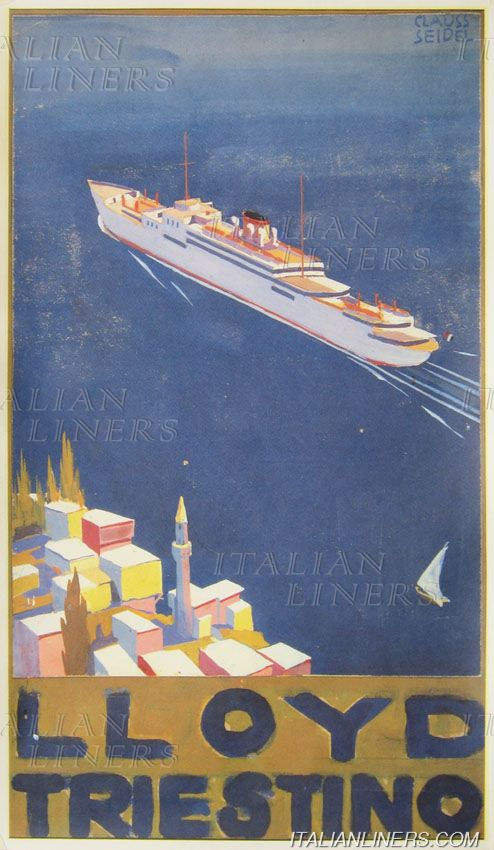
Locate an element on the screen. boxes is located at coordinates (242, 667).